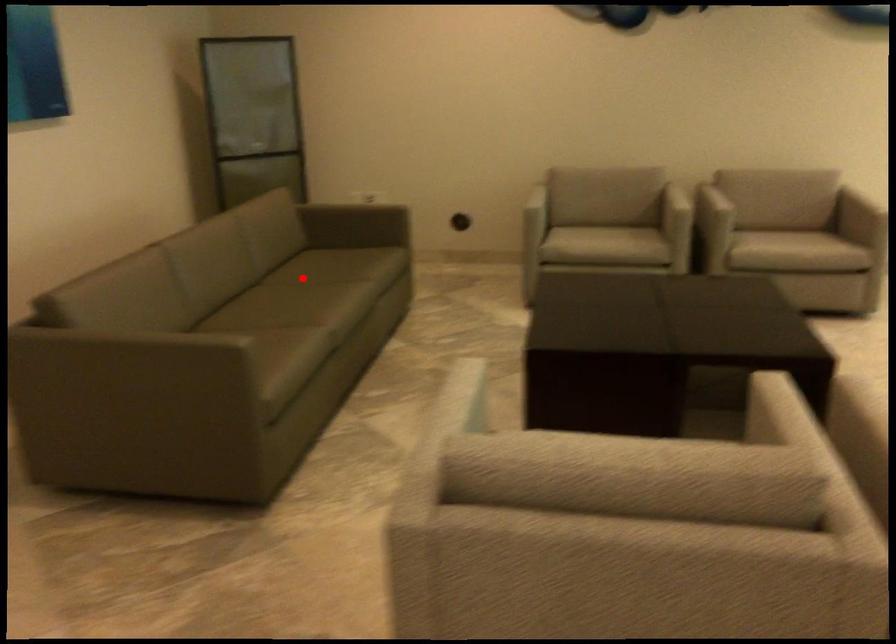
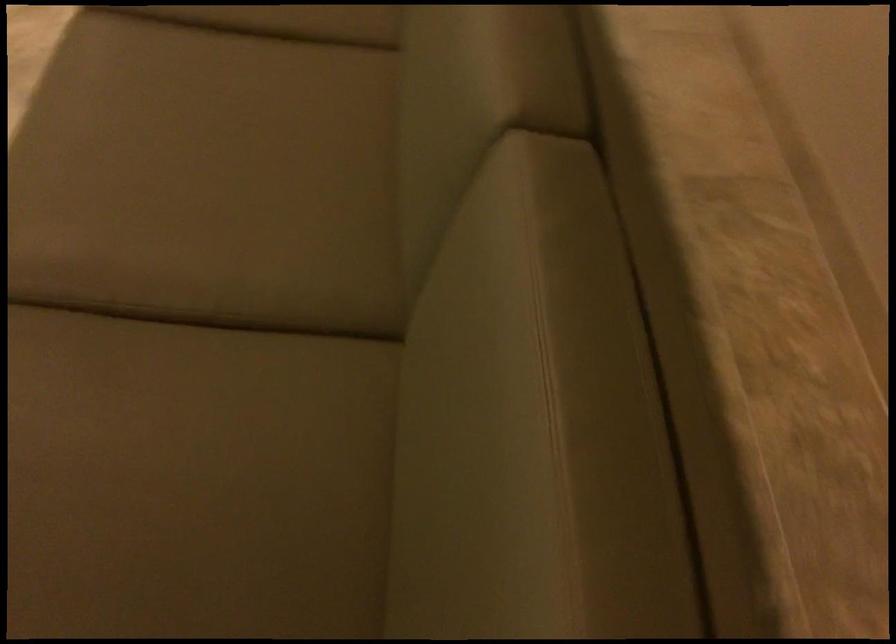
Question: A red point is marked in image1. In image2, is the corresponding 3D point closer to the camera or farther? Reply with the corresponding letter.

Choices:
 (A) The corresponding 3D point is closer.
 (B) The corresponding 3D point is farther.

Answer: (A)